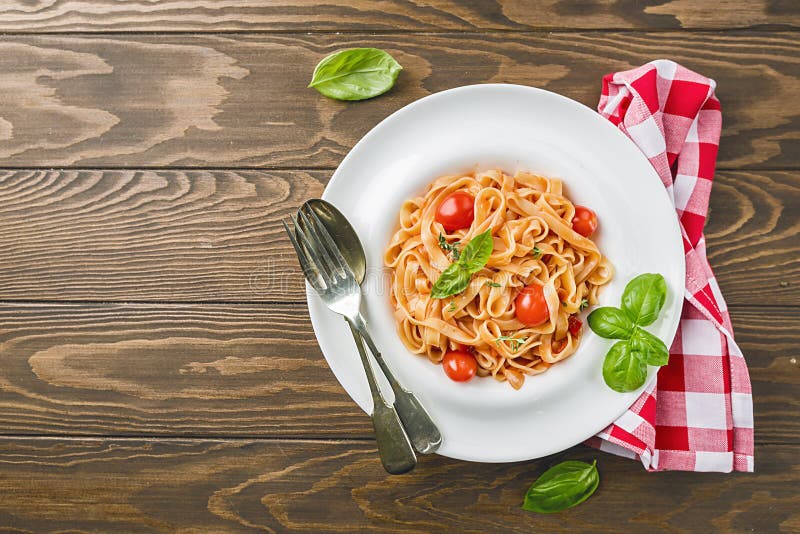
The width and height of the screenshot is (800, 534). Identify the location of spoon. (350, 241).